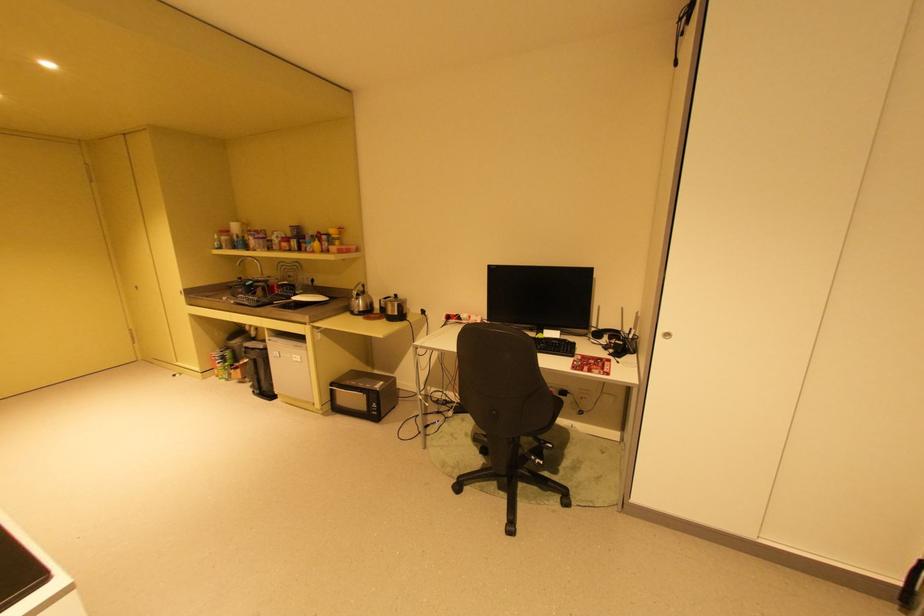
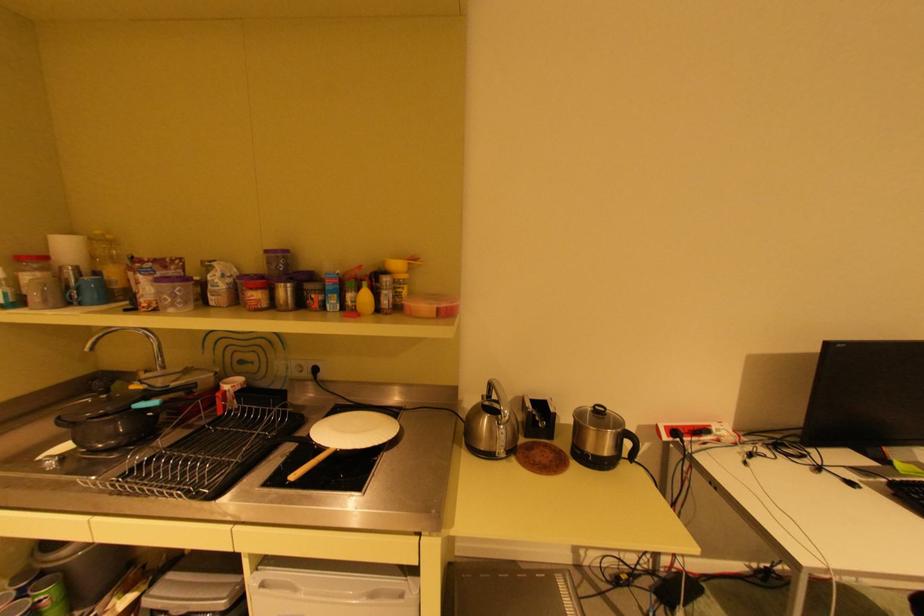
In a continuous first-person perspective shot, in which direction is the camera moving?

The cameraman walked toward left, forward.